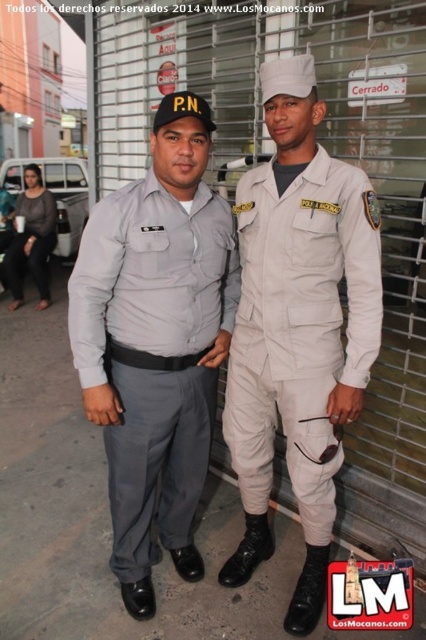
Can you confirm if beige fabric jumpsuit at center is thinner than matte black uniform at left?

Yes.

Does beige fabric jumpsuit at center have a greater width compared to matte black uniform at left?

No, beige fabric jumpsuit at center is not wider than matte black uniform at left.

Which is behind, point (336, 364) or point (11, 278)?

Positioned behind is point (11, 278).

Where is `beige fabric jumpsuit at center`? The width and height of the screenshot is (426, 640). beige fabric jumpsuit at center is located at coordinates (299, 324).

Is gray fabric shirt at center shorter than matte black uniform at left?

Correct, gray fabric shirt at center is not as tall as matte black uniform at left.

Is point (160, 196) positioned in front of point (39, 198)?

Yes, point (160, 196) is closer to viewer.

This screenshot has width=426, height=640. I want to click on gray fabric shirt at center, so click(x=154, y=349).

Is gray fabric shirt at center shorter than beige fabric jumpsuit at center?

Incorrect, gray fabric shirt at center's height does not fall short of beige fabric jumpsuit at center's.

Is point (135, 451) in front of point (302, 387)?

No, it is not.

Does point (198, 349) come behind point (285, 381)?

Yes, point (198, 349) is behind point (285, 381).

The image size is (426, 640). Identify the location of gray fabric shirt at center. (154, 349).